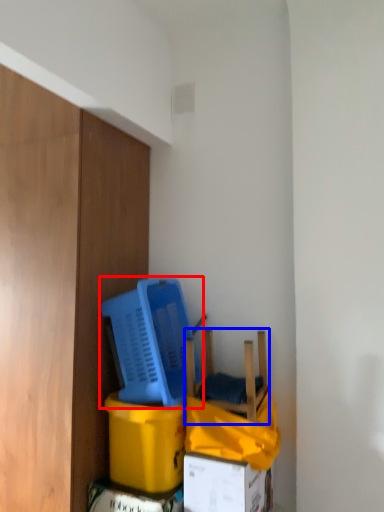
Question: Which object appears closest to the camera in this image, basket (highlighted by a red box) or chair (highlighted by a blue box)?

Choices:
 (A) basket
 (B) chair

Answer: (B)